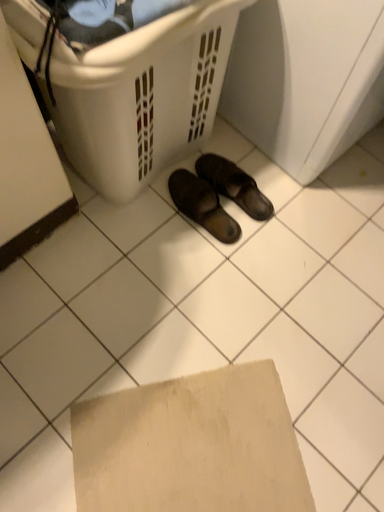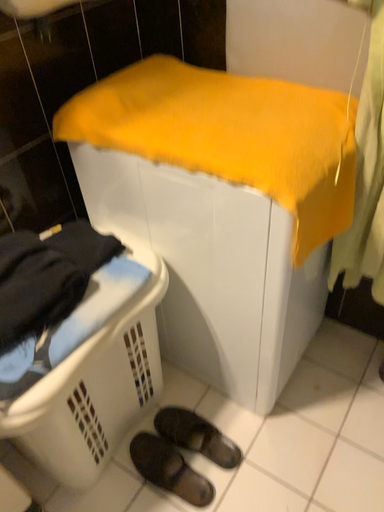
Question: Which way did the camera rotate in the video?

Choices:
 (A) rotated upward
 (B) rotated downward

Answer: (A)